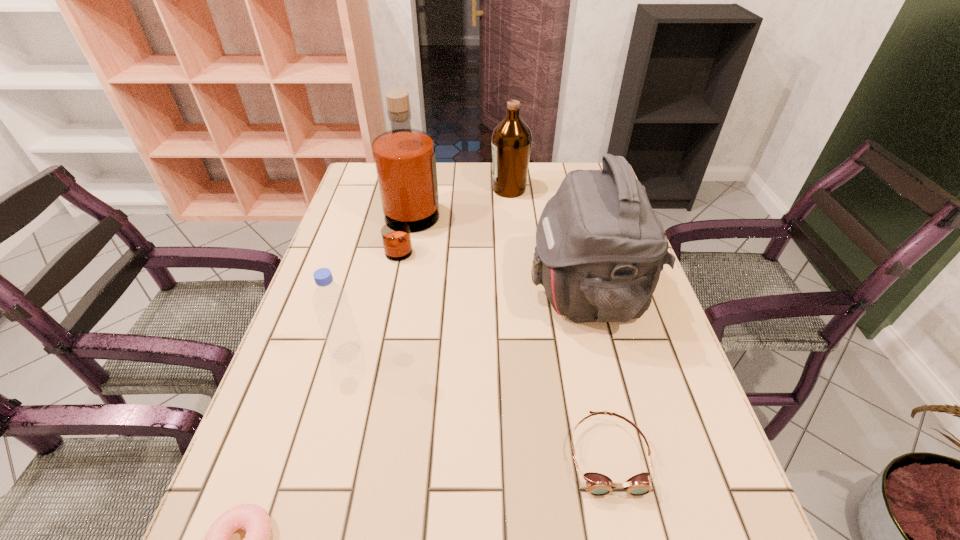
What are the coordinates of `liquor` in the screenshot? It's located at (405, 162).

Find the location of a particular element. This screenshot has height=540, width=960. shoulder bag is located at coordinates (600, 248).

Where is `the fourth shortest object`? the fourth shortest object is located at coordinates (511, 140).

Where is `olive oil`? olive oil is located at coordinates click(x=511, y=140).

The image size is (960, 540). Find the location of `the third shortest object`. the third shortest object is located at coordinates (330, 301).

Where is `goggles`? This screenshot has height=540, width=960. goggles is located at coordinates (598, 484).

You are a GUI agent. You are given a task and a screenshot of the screen. Output one action in this format:
    pyautogui.click(x=<x>, y=<y>)
    Task: Click on the second nearest object
    This screenshot has height=540, width=960.
    Given the screenshot: What is the action you would take?
    pyautogui.click(x=598, y=484)

Where is `vacant space located on the front label of the liquor`? This screenshot has width=960, height=540. vacant space located on the front label of the liquor is located at coordinates (500, 229).

Where is `free region located 0.160m on the open flap of the shoulder bag`? free region located 0.160m on the open flap of the shoulder bag is located at coordinates (465, 292).

Find the location of a particular element. Image resolution: width=960 pixels, height=540 pixels. vacant space located 0.110m on the open flap of the shoulder bag is located at coordinates (485, 292).